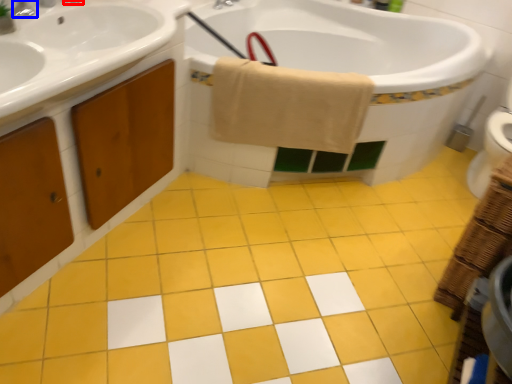
Question: Which object appears closest to the camera in this image, faucet (highlighted by a red box) or tap (highlighted by a blue box)?

Choices:
 (A) faucet
 (B) tap

Answer: (B)